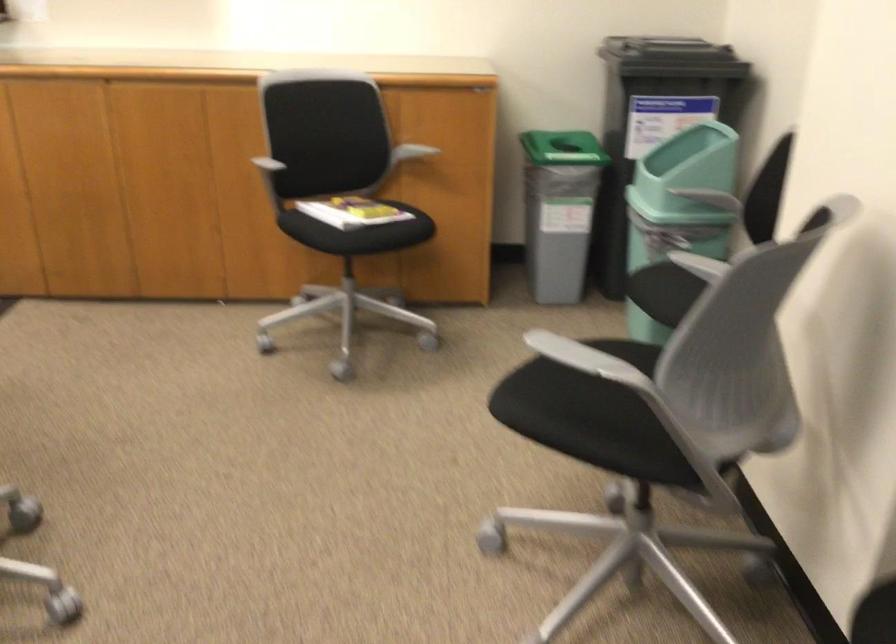
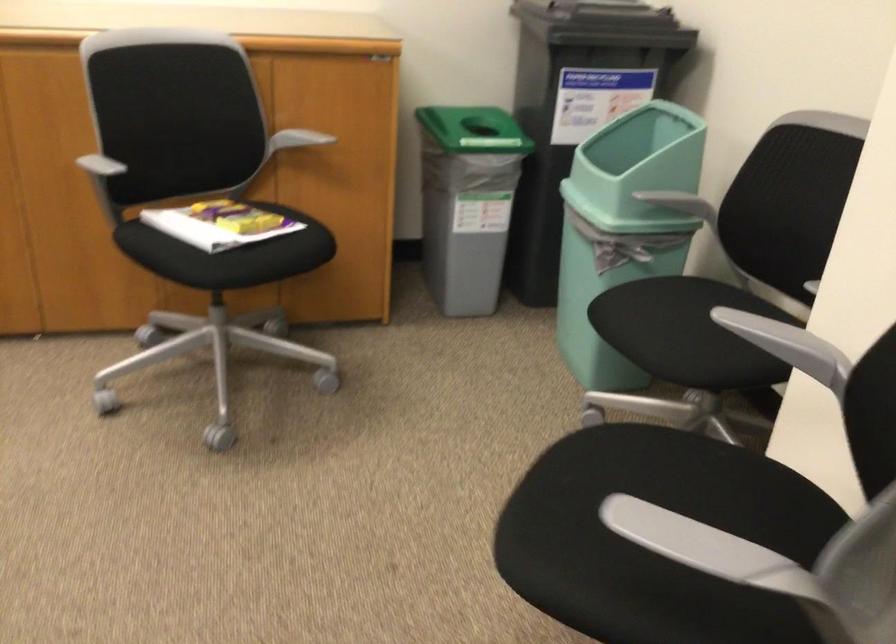
Question: Based on the continuous images, in which direction is the camera rotating? Reply with the corresponding letter.

Choices:
 (A) Left
 (B) Right
 (C) Up
 (D) Down

Answer: (B)